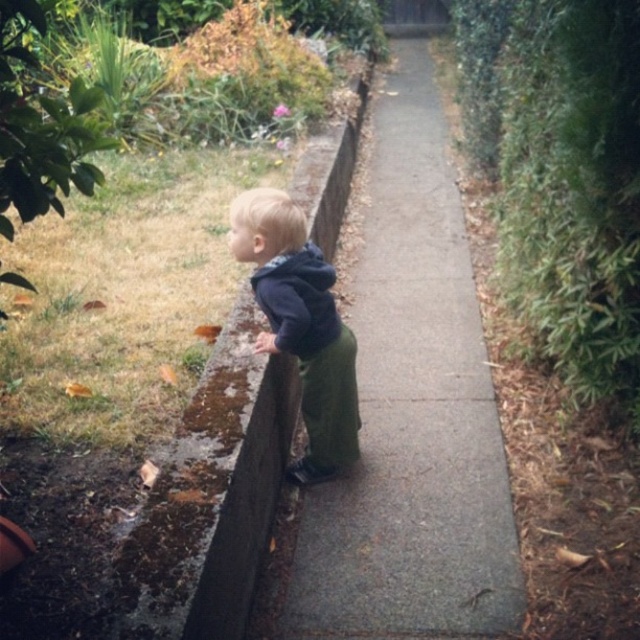
Question: Which point is closer to the camera?

Choices:
 (A) slate gray concrete at center
 (B) concrete at center
 (C) dark blue hoodie at center

Answer: (B)

Question: Is concrete at center closer to camera compared to slate gray concrete at center?

Choices:
 (A) yes
 (B) no

Answer: (A)

Question: Estimate the real-world distances between objects in this image. Which object is closer to the dark blue hoodie at center?

Choices:
 (A) concrete at center
 (B) slate gray concrete at center

Answer: (A)

Question: In this image, where is slate gray concrete at center located relative to dark blue hoodie at center?

Choices:
 (A) right
 (B) left

Answer: (A)

Question: Is slate gray concrete at center bigger than dark blue hoodie at center?

Choices:
 (A) yes
 (B) no

Answer: (A)

Question: Which of the following is the closest to the observer?

Choices:
 (A) slate gray concrete at center
 (B) dark blue hoodie at center

Answer: (B)